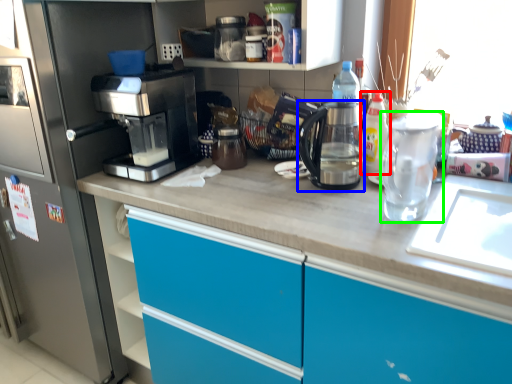
Question: Estimate the real-world distances between objects in this image. Which object is farther from bottle (highlighted by a red box), kitchen appliance (highlighted by a blue box) or tea pot (highlighted by a green box)?

Choices:
 (A) kitchen appliance
 (B) tea pot

Answer: (B)